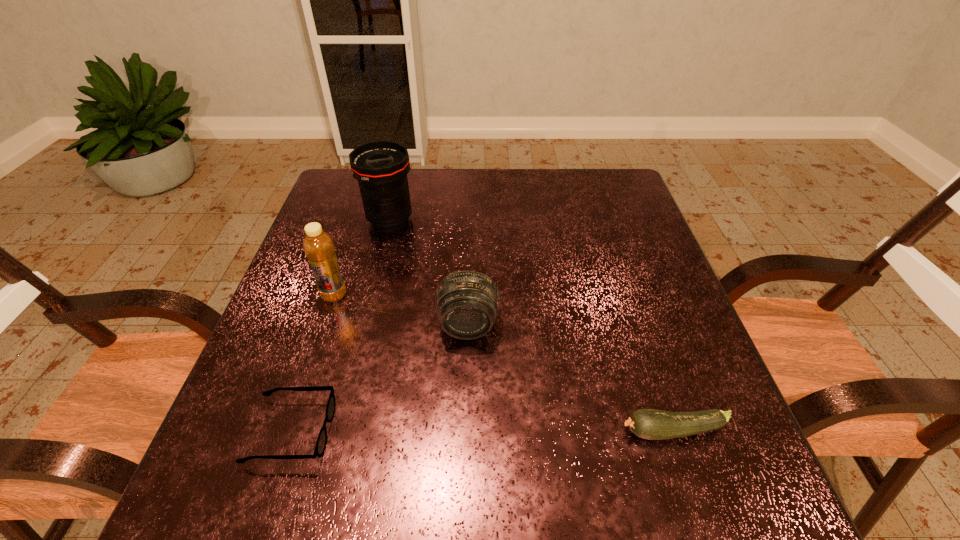
At what (x,y) coordinates should I click in order to perform the action: click on blank area located at the blossom end of the zucchini. Please return your answer as a coordinate pair (x, y). The image size is (960, 540). Looking at the image, I should click on (561, 431).

Locate an element on the screen. vacant region located 0.260m at the blossom end of the zucchini is located at coordinates (470, 431).

Identify the location of free space located 0.350m at the blossom end of the zucchini. This screenshot has width=960, height=540. (420, 431).

Identify the location of vacant space located 0.170m on the arms of the spectacles. The height and width of the screenshot is (540, 960). (426, 431).

Identify the location of object that is at the far edge. (381, 167).

You are a GUI agent. You are given a task and a screenshot of the screen. Output one action in this format:
    pyautogui.click(x=<x>, y=<y>)
    Task: Click on the object positioned at the near edge
    Image resolution: width=960 pixels, height=540 pixels.
    Given the screenshot: What is the action you would take?
    pyautogui.click(x=320, y=447)

The width and height of the screenshot is (960, 540). Find the location of `telephoto lens that is at the left edge`. telephoto lens that is at the left edge is located at coordinates (381, 167).

Where is `bottle present at the left edge`? The height and width of the screenshot is (540, 960). bottle present at the left edge is located at coordinates (318, 246).

Image resolution: width=960 pixels, height=540 pixels. I want to click on spectacles that is at the left edge, so click(320, 447).

Image resolution: width=960 pixels, height=540 pixels. I want to click on object situated at the right edge, so click(648, 424).